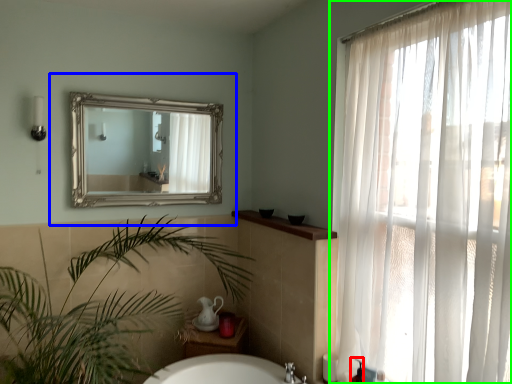
Question: Which is farther away from toiletry (highlighted by a red box)? medicine cabinet (highlighted by a blue box) or curtain (highlighted by a green box)?

Choices:
 (A) medicine cabinet
 (B) curtain

Answer: (A)